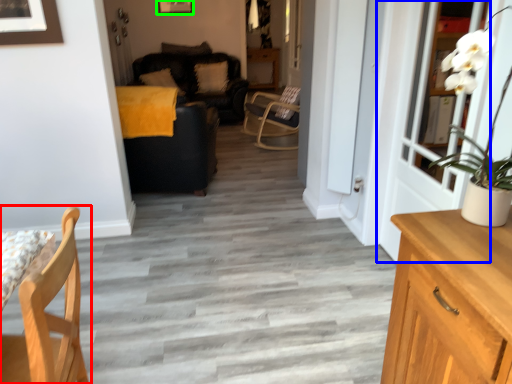
Question: Based on their relative distances, which object is farther from chair (highlighted by a red box)? Choose from door (highlighted by a blue box) and picture frame (highlighted by a green box).

Choices:
 (A) door
 (B) picture frame

Answer: (B)